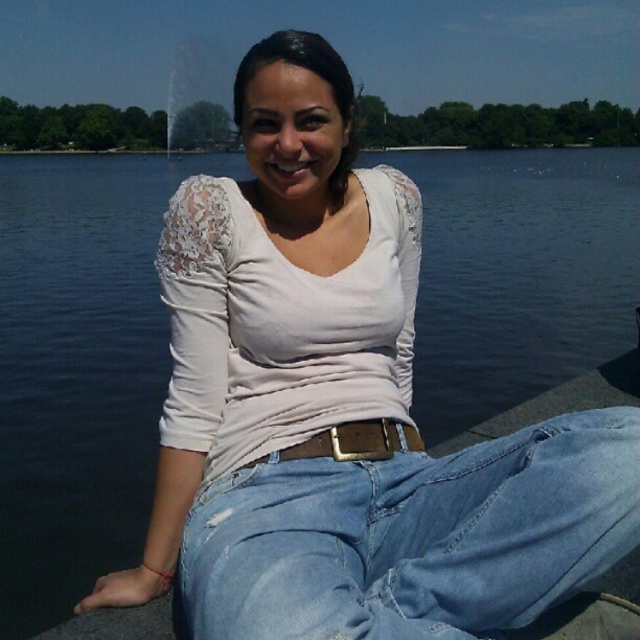
Does denim jeans at lower center have a lesser height compared to brown leather belt at center?

No, denim jeans at lower center is not shorter than brown leather belt at center.

Who is lower down, denim jeans at lower center or brown leather belt at center?

denim jeans at lower center is lower down.

The image size is (640, 640). In order to click on denim jeans at lower center in this screenshot , I will do `click(413, 536)`.

Locate an element on the screen. denim jeans at lower center is located at coordinates (413, 536).